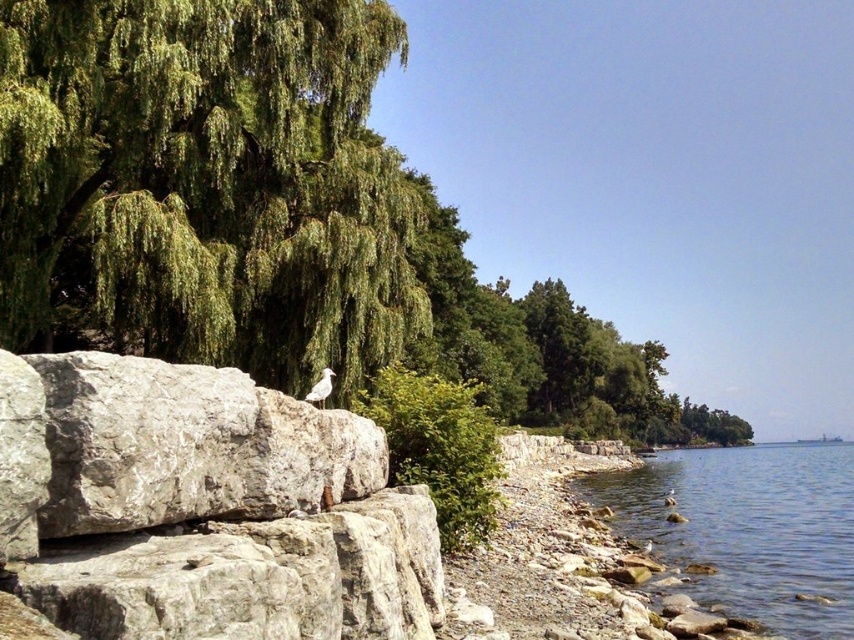
Does clear water at shore right have a lesser width compared to white matte bird at lower right?

No.

Is clear water at shore right bigger than white matte bird at lower right?

Indeed, clear water at shore right has a larger size compared to white matte bird at lower right.

Between point (647, 518) and point (671, 497), which one is positioned in front?

Point (647, 518)

The width and height of the screenshot is (854, 640). Find the location of `clear water at shore right`. clear water at shore right is located at coordinates (747, 529).

Is clear water at shore right taller than white feathered bird at center?

Indeed, clear water at shore right has a greater height compared to white feathered bird at center.

Describe the element at coordinates (747, 529) in the screenshot. I see `clear water at shore right` at that location.

I want to click on clear water at shore right, so click(x=747, y=529).

Can you confirm if white feathered bird at center is taller than white matte bird at lower right?

No.

Is white feathered bird at center below white matte bird at lower right?

Actually, white feathered bird at center is above white matte bird at lower right.

Does point (323, 387) lie in front of point (670, 506)?

Yes.

Identify the location of white feathered bird at center. (320, 388).